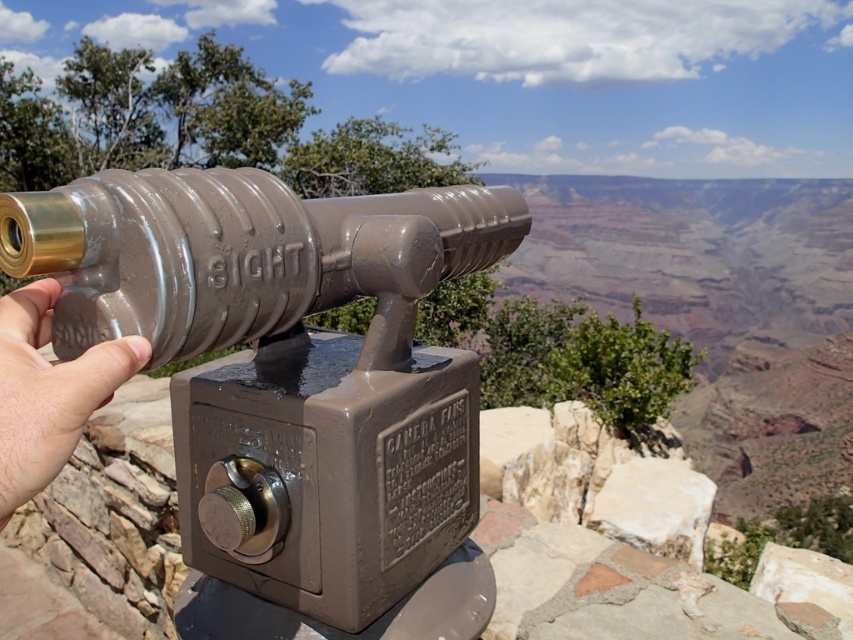
Does matte brown telescope at center appear on the right side of pale skin at center?

Indeed, matte brown telescope at center is positioned on the right side of pale skin at center.

Is matte brown telescope at center smaller than pale skin at center?

Incorrect, matte brown telescope at center is not smaller in size than pale skin at center.

Where is `matte brown telescope at center`? matte brown telescope at center is located at coordinates (285, 364).

Find the location of `matte brown telescope at center`. matte brown telescope at center is located at coordinates (285, 364).